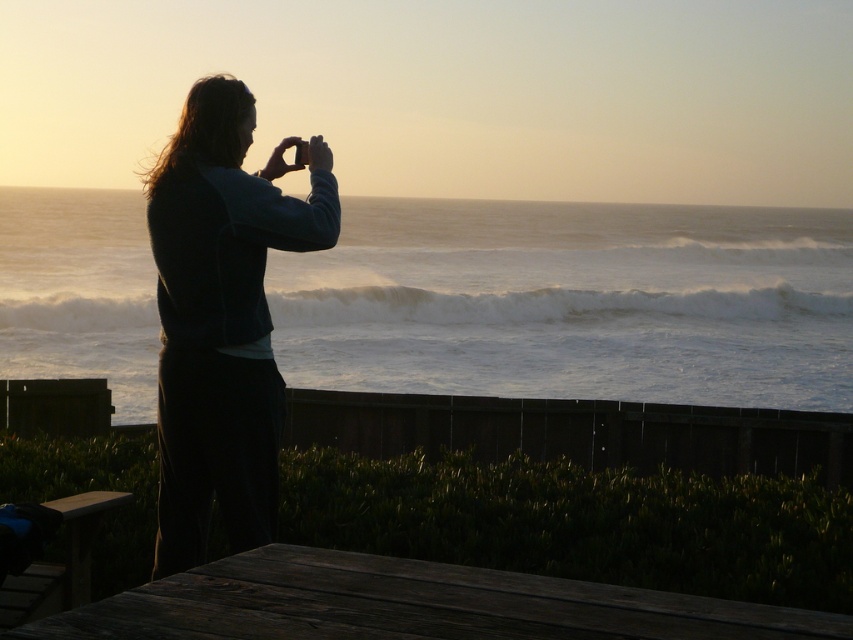
You are a photographer on the deck and want to place a small tripod between the silhouette fabric jacket at left and the dark brown wooden picnic table at lower center. Which object should you position the tripod closer to to ensure it doesn

The silhouette fabric jacket at left is taller than the dark brown wooden picnic table at lower center. Therefore, positioning the tripod closer to the dark brown wooden picnic table at lower center would provide a more stable base due to its lower height, reducing the risk of the tripod tipping over.

You are a photographer trying to capture the sunset. You have a camera with a 35mm lens. The silhouette fabric jacket at left and the dark brown wooden picnic table at lower center are both in your frame. Which object will appear larger in your photo?

The silhouette fabric jacket at left will appear larger in the photo because it is bigger than the dark brown wooden picnic table at lower center.

You are standing on the wooden deck and want to place a small potted plant exactly where the silhouette fabric jacket at left is currently positioned. Is this location suitable for placing the plant?

The silhouette fabric jacket at left is located at point (222, 317), so yes, you can place the small potted plant there as the coordinates are specific and the area is accessible on the wooden deck.